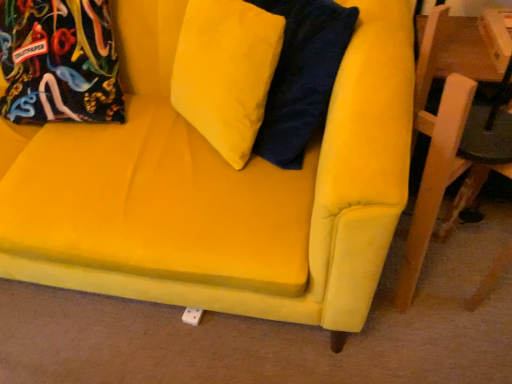
Identify the location of vacant space underneath wooden chair at right (from a real-world perspective). The height and width of the screenshot is (384, 512). (437, 271).